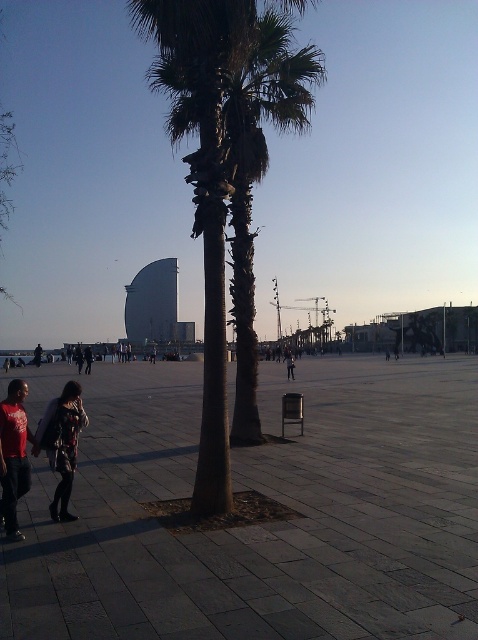
Who is more distant from viewer, (49, 387) or (292, 358)?

The point (292, 358) is behind.

Does point (152, 410) lie in front of point (290, 353)?

Yes, point (152, 410) is closer to viewer.

You are a GUI agent. You are given a task and a screenshot of the screen. Output one action in this format:
    pyautogui.click(x=<x>, y=<y>)
    Task: Click on the dark stone plaza at center
    The image size is (478, 640).
    Given the screenshot: What is the action you would take?
    pyautogui.click(x=261, y=522)

How distant is dark gray fabric coat at lower left from red cotton shirt at lower left?

A distance of 33.67 inches exists between dark gray fabric coat at lower left and red cotton shirt at lower left.

Is point (36, 438) closer to viewer compared to point (11, 420)?

No, it is behind (11, 420).

Image resolution: width=478 pixels, height=640 pixels. What are the coordinates of `dark gray fabric coat at lower left` in the screenshot? It's located at tap(62, 444).

Where is `dark gray fabric coat at lower left`? Image resolution: width=478 pixels, height=640 pixels. dark gray fabric coat at lower left is located at coordinates (62, 444).

Between dark stone plaza at center and dark gray fabric coat at lower left, which one has less height?

dark gray fabric coat at lower left is shorter.

Who is more forward, (107, 496) or (64, 422)?

Point (64, 422)

At what (x,y) coordinates should I click in order to perform the action: click on dark stone plaza at center. Please return your answer as a coordinate pair (x, y). This screenshot has width=478, height=640. Looking at the image, I should click on (261, 522).

Find the location of a particular element. dark stone plaza at center is located at coordinates (261, 522).